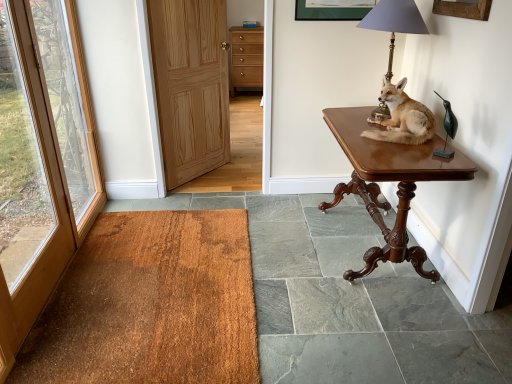
Locate an element on the screen. This screenshot has width=512, height=384. vacant space situated above brown textured mat at lower left (from a real-world perspective) is located at coordinates (155, 280).